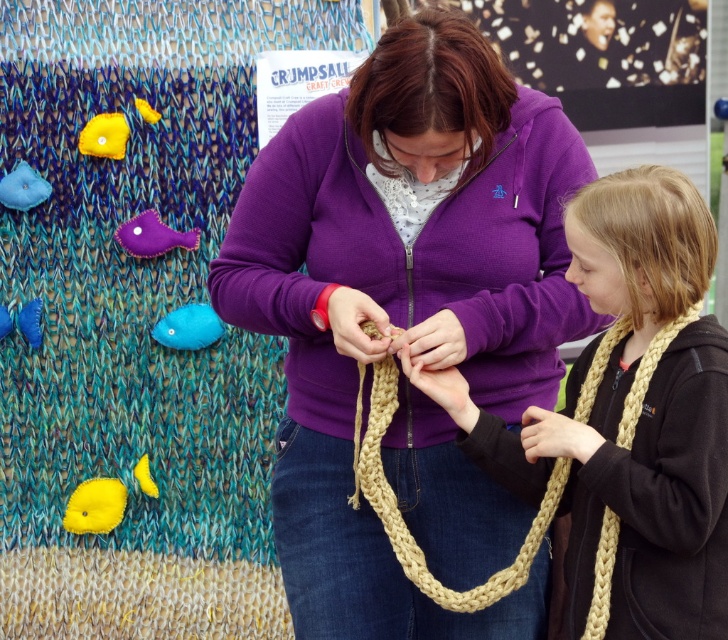
You are a tailor trying to determine if a small hook can be placed between the black fleece jacket at lower right and the blue felt fish at upper left. Can you fit the hook between them?

The black fleece jacket at lower right is taller than the blue felt fish at upper left, so the hook can be placed between them as there is sufficient vertical space.